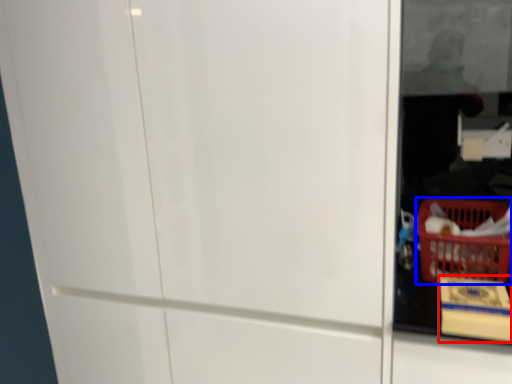
Question: Which of the following is the farthest to the observer, cardboard box (highlighted by a red box) or basket (highlighted by a blue box)?

Choices:
 (A) cardboard box
 (B) basket

Answer: (B)